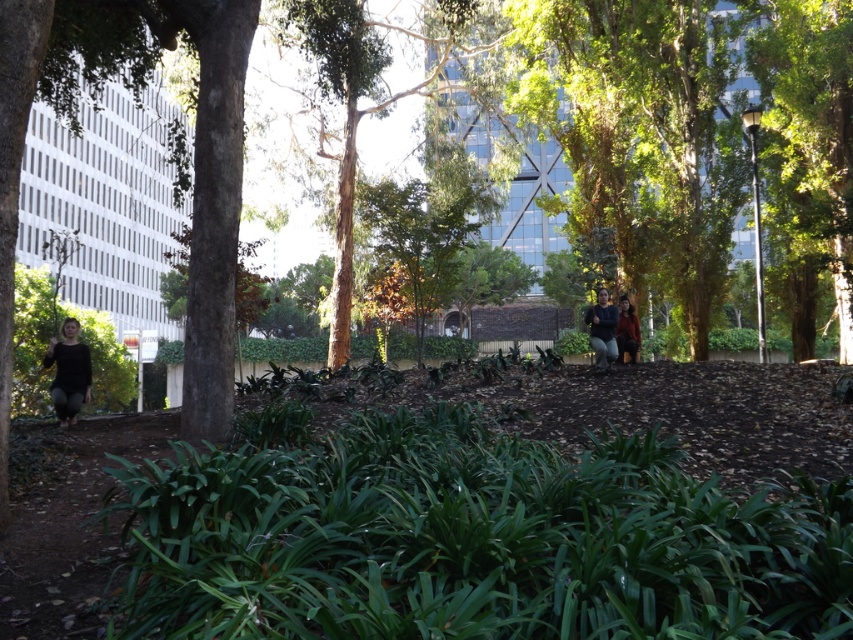
Question: Does matte brown jacket at center appear over brown leather jacket at center?

Choices:
 (A) yes
 (B) no

Answer: (B)

Question: Does matte black pants at lower left appear under brown leather jacket at center?

Choices:
 (A) no
 (B) yes

Answer: (B)

Question: Among these objects, which one is farthest from the camera?

Choices:
 (A) smooth bark tree at center
 (B) matte brown jacket at center
 (C) brown leather jacket at center
 (D) matte black pants at lower left

Answer: (A)

Question: Which point is farther to the camera?

Choices:
 (A) (625, 339)
 (B) (61, 400)
 (C) (631, 340)
 (D) (357, 97)

Answer: (D)

Question: Which is nearer to the brown leather jacket at center?

Choices:
 (A) matte black pants at lower left
 (B) smooth bark tree at center

Answer: (A)

Question: Is matte black pants at lower left wider than brown leather jacket at center?

Choices:
 (A) no
 (B) yes

Answer: (A)